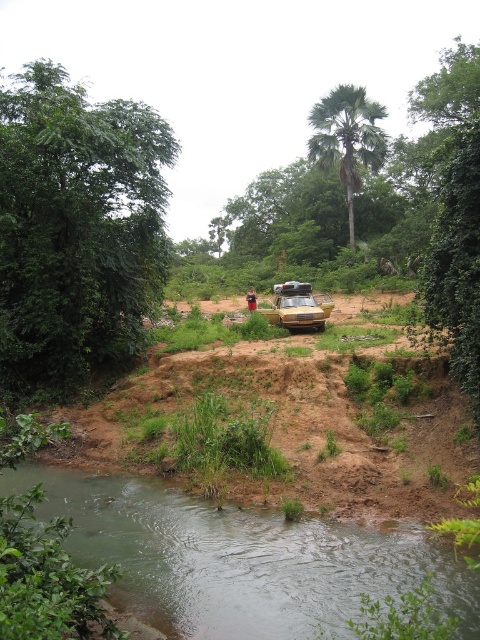
Who is positioned more to the left, brown sandy dirt field at center or gold metallic car at center?

brown sandy dirt field at center is more to the left.

Does brown sandy dirt field at center have a larger size compared to gold metallic car at center?

Yes, brown sandy dirt field at center is bigger than gold metallic car at center.

The height and width of the screenshot is (640, 480). Identify the location of brown sandy dirt field at center. (289, 428).

Is green leafy tree at upper left bigger than green smooth water at lower center?

Yes, green leafy tree at upper left is bigger than green smooth water at lower center.

Does point (55, 186) come closer to viewer compared to point (275, 586)?

That is False.

In order to click on green leafy tree at upper left in this screenshot , I will do `click(75, 228)`.

Is point (0, 129) positioned in front of point (323, 108)?

Yes, it is in front of point (323, 108).

Is green leafy tree at upper left behind green leafy palm tree at upper center?

No, green leafy tree at upper left is closer to the viewer.

Between point (7, 198) and point (312, 122), which one is positioned in front?

Point (7, 198) is more forward.

Locate an element on the screen. This screenshot has width=480, height=640. green leafy tree at upper left is located at coordinates pyautogui.click(x=75, y=228).